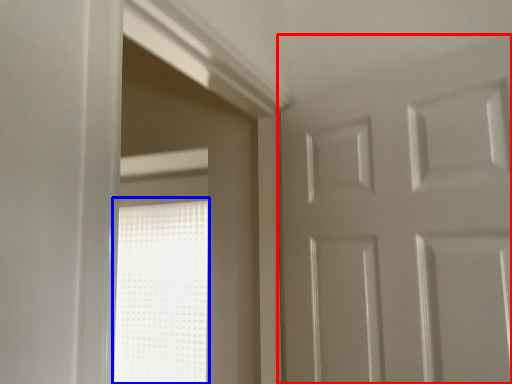
Question: Which of the following is the farthest to the observer, door (highlighted by a red box) or window (highlighted by a blue box)?

Choices:
 (A) door
 (B) window

Answer: (B)